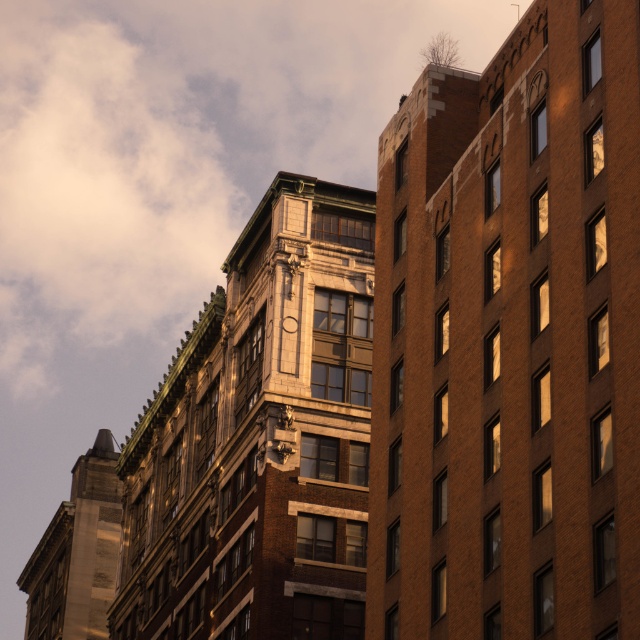
Question: Among these objects, which one is farthest from the camera?

Choices:
 (A) brown brick building at right
 (B) wooden clock at upper center

Answer: (B)

Question: Which point is farther to the camera?

Choices:
 (A) brown brick building at right
 (B) wooden clock at upper center

Answer: (B)

Question: Which point appears farthest from the camera in this image?

Choices:
 (A) (385, 243)
 (B) (289, 317)

Answer: (B)

Question: Can you confirm if brown brick building at right is positioned above wooden clock at upper center?

Choices:
 (A) yes
 (B) no

Answer: (B)

Question: Does brown brick building at right lie in front of wooden clock at upper center?

Choices:
 (A) yes
 (B) no

Answer: (A)

Question: Does brown brick building at right appear under wooden clock at upper center?

Choices:
 (A) no
 (B) yes

Answer: (B)